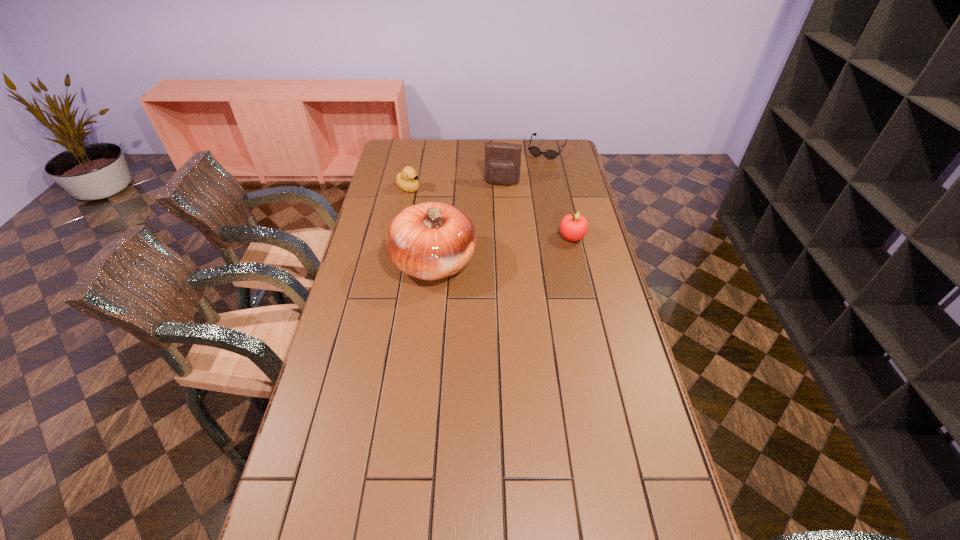
Where is `pumpkin`? The image size is (960, 540). pumpkin is located at coordinates point(430,241).

The width and height of the screenshot is (960, 540). I want to click on apple, so click(x=573, y=227).

Identify the location of the second tallest object. This screenshot has height=540, width=960. (502, 160).

Identify the location of pouch. The width and height of the screenshot is (960, 540). (502, 160).

This screenshot has width=960, height=540. What are the coordinates of `duckling` in the screenshot? It's located at (406, 180).

The height and width of the screenshot is (540, 960). What are the coordinates of `the shortest object` in the screenshot? It's located at [x=535, y=151].

Where is `the farthest object`? The width and height of the screenshot is (960, 540). the farthest object is located at coordinates (535, 151).

Find the location of `free space located 0.400m on the right of the tallest object`. free space located 0.400m on the right of the tallest object is located at coordinates (590, 264).

Locate an element on the screen. free point located on the front of the apple is located at coordinates (577, 258).

This screenshot has width=960, height=540. What are the coordinates of `free spot located with an open flap on the pouch` in the screenshot? It's located at (497, 200).